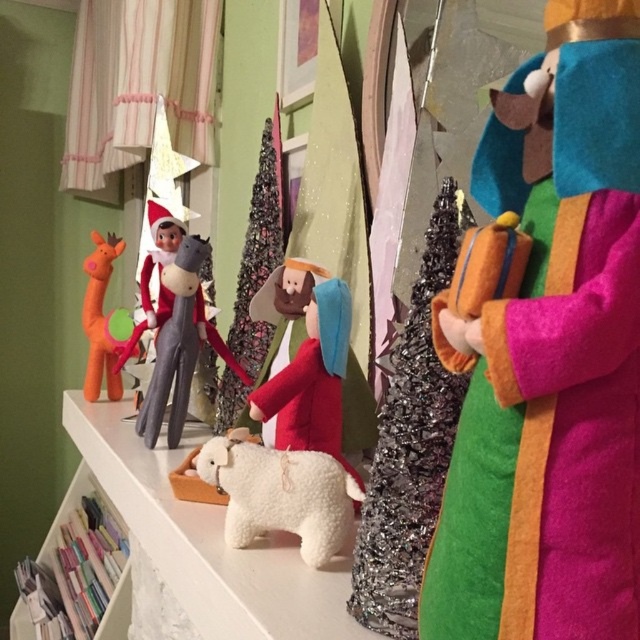
Question: Among these points, which one is nearest to the camera?

Choices:
 (A) (544, 189)
 (B) (237, 481)

Answer: (A)

Question: Does velvet green robe at center have a larger size compared to white plush bear at center?

Choices:
 (A) yes
 (B) no

Answer: (B)

Question: Which point appears farthest from the camera in this image?

Choices:
 (A) (301, 529)
 (B) (164, 337)

Answer: (B)

Question: Does white plush bear at center appear under velvety gray horse at center?

Choices:
 (A) no
 (B) yes

Answer: (B)

Question: Observing the image, what is the correct spatial positioning of white plush bear at center in reference to orange felt giraffe at left?

Choices:
 (A) left
 (B) right

Answer: (B)

Question: Which object appears closest to the camera in this image?

Choices:
 (A) velvety gray horse at center
 (B) pastel paper at lower left

Answer: (A)